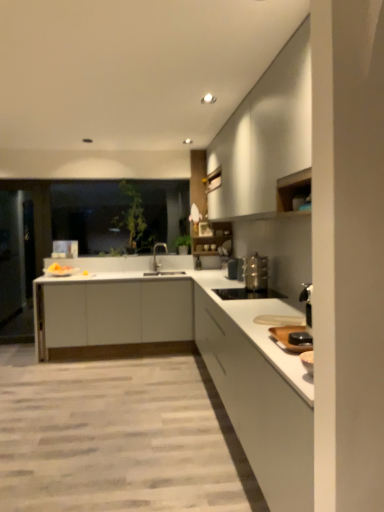
Question: Considering their positions, is transparent glass door at left located in front of or behind white matte cabinet at right, the third cabinetry viewed from the top?

Choices:
 (A) front
 (B) behind

Answer: (B)

Question: In terms of height, does transparent glass door at left look taller or shorter compared to white matte cabinet at right, the third cabinetry viewed from the top?

Choices:
 (A) short
 (B) tall

Answer: (B)

Question: Which object is positioned farthest from the transparent glass door at left?

Choices:
 (A) transparent glass window at center
 (B) white matte countertop at center
 (C) satin silver toaster at lower right, arranged as the 2th appliance when viewed from the top
 (D) white matte cabinet at upper right, the third cabinetry in the bottom-to-top sequence
 (E) satin silver toaster at right, arranged as the second appliance when ordered from the bottom

Answer: (E)

Question: Which is nearer to the satin nickel faucet at center?

Choices:
 (A) white matte countertop at center
 (B) transparent glass door at left
 (C) satin silver toaster at right, arranged as the second appliance when ordered from the bottom
 (D) white matte cabinet at center, the 2th cabinetry from the top
 (E) transparent glass window at center

Answer: (E)